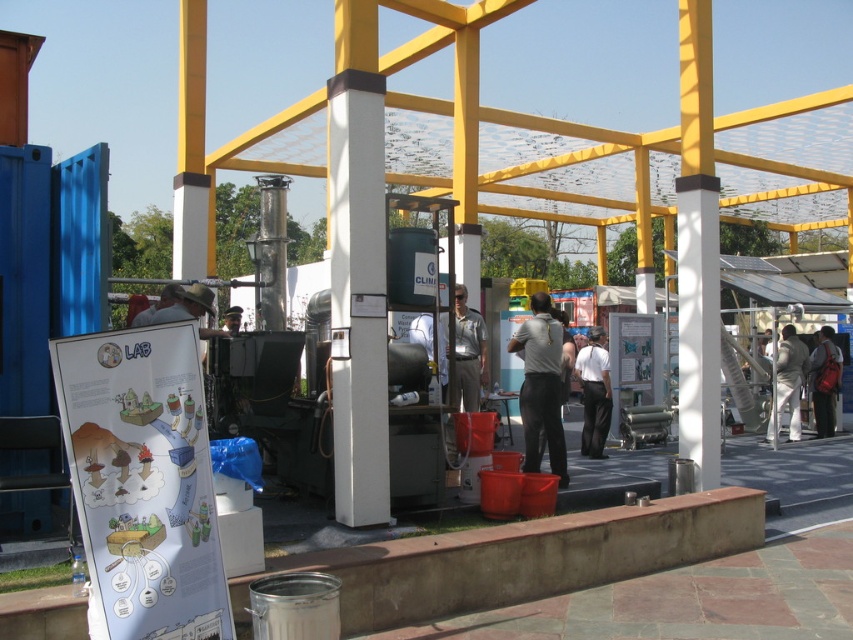
Who is more distant from viewer, (521, 387) or (809, 378)?

The point (809, 378) is behind.

Where is `dark gray uniform at center`? dark gray uniform at center is located at coordinates (541, 387).

Identify the location of dark gray uniform at center. This screenshot has width=853, height=640. (541, 387).

Identify the location of dark gray uniform at center. Image resolution: width=853 pixels, height=640 pixels. (541, 387).

Between point (819, 360) and point (223, 320), which one is positioned in front?

Positioned in front is point (223, 320).

Between point (814, 404) and point (234, 320), which one is positioned behind?

Positioned behind is point (814, 404).

Does point (822, 401) lie behind point (236, 314)?

Yes, it is.

Image resolution: width=853 pixels, height=640 pixels. In order to click on red backpack at right in this screenshot , I will do `click(824, 380)`.